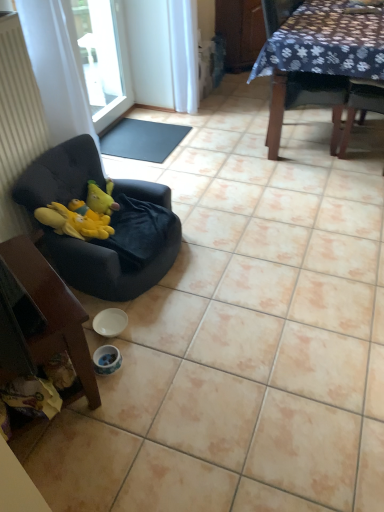
Question: From the image's perspective, is white fabric curtain at left below transparent glass window at upper left?

Choices:
 (A) yes
 (B) no

Answer: (A)

Question: Is white fabric curtain at left oriented away from transparent glass window at upper left?

Choices:
 (A) yes
 (B) no

Answer: (B)

Question: Is the depth of white fabric curtain at left greater than that of transparent glass window at upper left?

Choices:
 (A) no
 (B) yes

Answer: (A)

Question: Would you say white fabric curtain at left is outside transparent glass window at upper left?

Choices:
 (A) yes
 (B) no

Answer: (A)

Question: Does white fabric curtain at left turn towards transparent glass window at upper left?

Choices:
 (A) no
 (B) yes

Answer: (A)

Question: Visually, is white glossy bowl at lower center positioned to the left or to the right of black rubber mat at center?

Choices:
 (A) right
 (B) left

Answer: (A)

Question: Looking at their shapes, would you say white glossy bowl at lower center is wider or thinner than black rubber mat at center?

Choices:
 (A) wide
 (B) thin

Answer: (B)

Question: From the image's perspective, is white glossy bowl at lower center located above or below black rubber mat at center?

Choices:
 (A) below
 (B) above

Answer: (A)

Question: Do you think white glossy bowl at lower center is within black rubber mat at center, or outside of it?

Choices:
 (A) inside
 (B) outside

Answer: (B)

Question: Is point (137, 136) positioned closer to the camera than point (342, 95)?

Choices:
 (A) closer
 (B) farther

Answer: (B)

Question: Based on their sizes in the image, would you say black rubber mat at center is bigger or smaller than dark fabric chair at upper right, arranged as the 1th chair when viewed from the right?

Choices:
 (A) small
 (B) big

Answer: (A)

Question: From the image's perspective, is black rubber mat at center above or below dark fabric chair at upper right, arranged as the 1th chair when viewed from the right?

Choices:
 (A) above
 (B) below

Answer: (B)

Question: Considering the positions of black rubber mat at center and dark fabric chair at upper right, the third chair ordered from the bottom, in the image, is black rubber mat at center taller or shorter than dark fabric chair at upper right, the third chair ordered from the bottom,?

Choices:
 (A) tall
 (B) short

Answer: (B)

Question: Is velvet black chair at left, which is the second chair from top to bottom, situated inside wooden chair at lower left, the first chair when ordered from front to back, or outside?

Choices:
 (A) outside
 (B) inside

Answer: (A)

Question: From a real-world perspective, is velvet black chair at left, the second chair when ordered from right to left, above or below wooden chair at lower left, acting as the third chair starting from the right?

Choices:
 (A) below
 (B) above

Answer: (B)